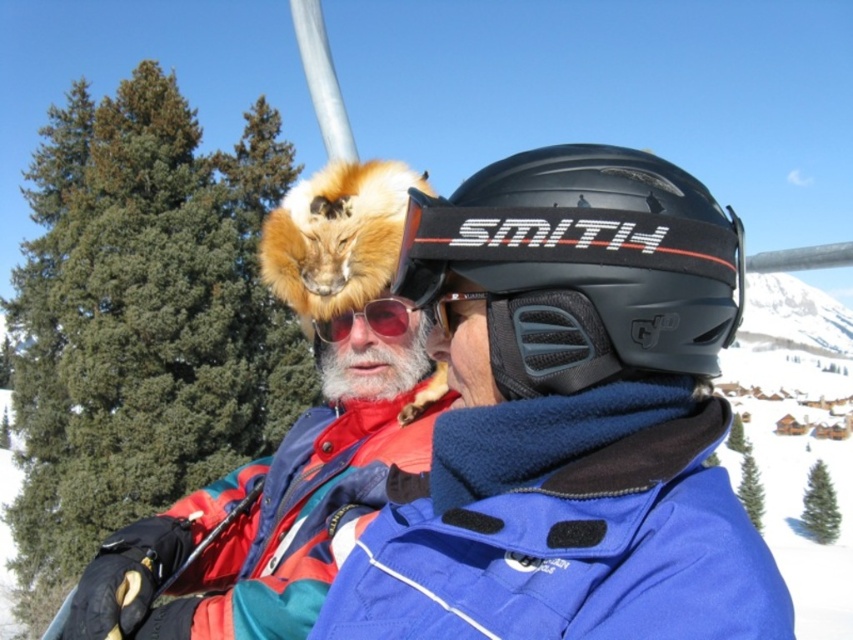
You are a photographer trying to capture a candid shot of two people talking. You notice the black matte helmet at center and the red reflective lens goggles at center. Which object should you avoid pointing your camera at to prevent glare from the sun? Explain your reasoning.

The red reflective lens goggles at center should be avoided because reflective surfaces like goggles can cause glare, especially when facing sunlight. The black matte helmet at center has a non reflective surface and is less likely to produce glare.

You are a photographer standing at the base of a ski slope. You want to take a photo of the blue fleece jacket at center and the fuzzy fur hat at upper left so that they appear the same size in the photo. Given their current distance apart, which object should you move closer to the camera and by how much?

To make the blue fleece jacket at center and the fuzzy fur hat at upper left appear the same size in the photo, you should move the fuzzy fur hat at upper left closer to the camera by approximately 5.98 meters. Since the blue fleece jacket at center is already 5.98 meters away from the fuzzy fur hat at upper left, bringing the hat closer would balance their sizes in the frame.

You are a photographer trying to capture a clear photo of the fuzzy fur hat at upper left and the matte black goggles at center. Since you want both objects to be in focus, you need to know their vertical positions. Which object is lower in the image?

The fuzzy fur hat at upper left is below matte black goggles at center, so the fuzzy fur hat at upper left is lower in the image.